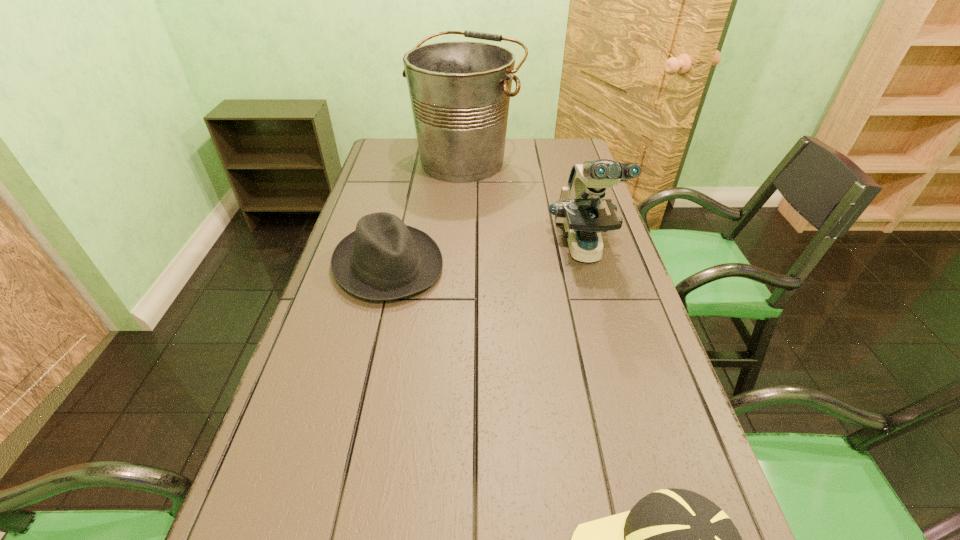
I want to click on the farthest object, so click(x=460, y=91).

Where is `the tallest object`? The height and width of the screenshot is (540, 960). the tallest object is located at coordinates (460, 91).

You are a GUI agent. You are given a task and a screenshot of the screen. Output one action in this format:
    pyautogui.click(x=<x>, y=<y>)
    Task: Click on the microscope
    The width and height of the screenshot is (960, 540).
    Given the screenshot: What is the action you would take?
    pos(581,209)

At what (x,y) coordinates should I click in order to perform the action: click on fedora. Please return your answer as a coordinate pair (x, y). The height and width of the screenshot is (540, 960). Looking at the image, I should click on (383, 259).

Where is `free space located 0.350m on the front of the farthest object`? The width and height of the screenshot is (960, 540). free space located 0.350m on the front of the farthest object is located at coordinates (461, 252).

At what (x,y) coordinates should I click in order to perform the action: click on vacant space located through the eyepieces of the microscope. Please return your answer as a coordinate pair (x, y). The image size is (960, 540). Looking at the image, I should click on (605, 326).

Locate an element on the screen. vacant region located 0.280m on the back of the fedora is located at coordinates point(408,182).

Identify the location of object situated at the far edge. The image size is (960, 540). (460, 91).

This screenshot has height=540, width=960. Identify the location of bucket at the left edge. (460, 91).

Locate an element on the screen. fedora that is positioned at the left edge is located at coordinates (383, 259).